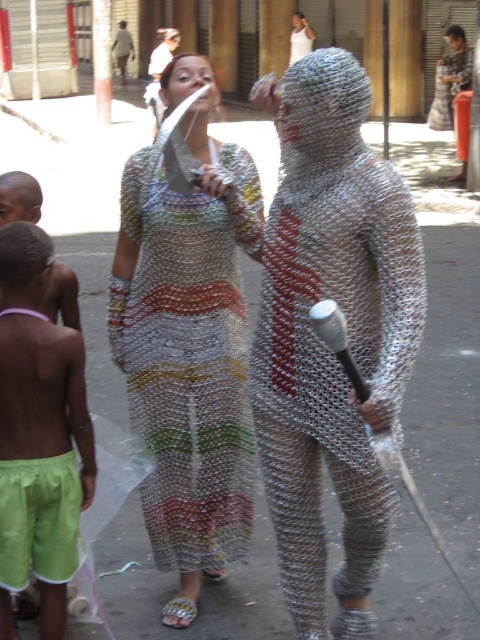
How far apart are multicolored mesh dress at center and white tank top at upper center?

multicolored mesh dress at center and white tank top at upper center are 17.84 meters apart from each other.

Which is in front, point (140, 429) or point (299, 33)?

Point (140, 429) is in front.

Is point (211, 467) positioned in front of point (291, 60)?

Yes.

This screenshot has height=640, width=480. Find the location of `multicolored mesh dress at center`. multicolored mesh dress at center is located at coordinates (189, 342).

Who is positioned more to the left, chainmail armor at center or green fabric shorts at lower left?

Positioned to the left is green fabric shorts at lower left.

Who is lower down, chainmail armor at center or green fabric shorts at lower left?

Positioned lower is green fabric shorts at lower left.

Is point (287, 273) closer to camera compared to point (59, 349)?

Yes, it is.

You are a GUI agent. You are given a task and a screenshot of the screen. Output one action in this format:
    pyautogui.click(x=<x>, y=<y>)
    Task: Click on the chainmail armor at center
    The image size is (480, 640).
    Given the screenshot: What is the action you would take?
    pyautogui.click(x=321, y=340)

Who is shorter, multicolored mesh dress at center or metallic chainmail suit at upper right?

With less height is metallic chainmail suit at upper right.

Does multicolored mesh dress at center have a larger size compared to metallic chainmail suit at upper right?

No, multicolored mesh dress at center is not bigger than metallic chainmail suit at upper right.

Is point (217, 92) more distant than point (458, 81)?

No, it is in front of (458, 81).

Locate an element on the screen. The width and height of the screenshot is (480, 640). multicolored mesh dress at center is located at coordinates (189, 342).